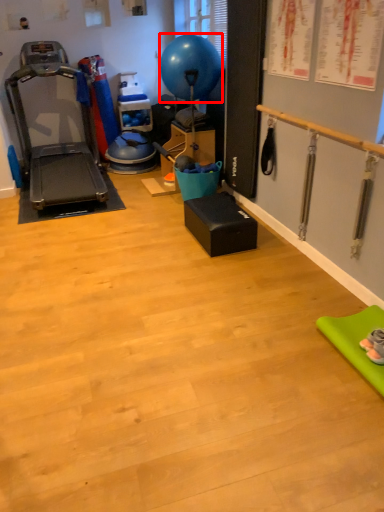
Question: From the image's perspective, what is the correct spatial positioning of balloon (annotated by the red box) in reference to treadmill?

Choices:
 (A) above
 (B) below

Answer: (A)